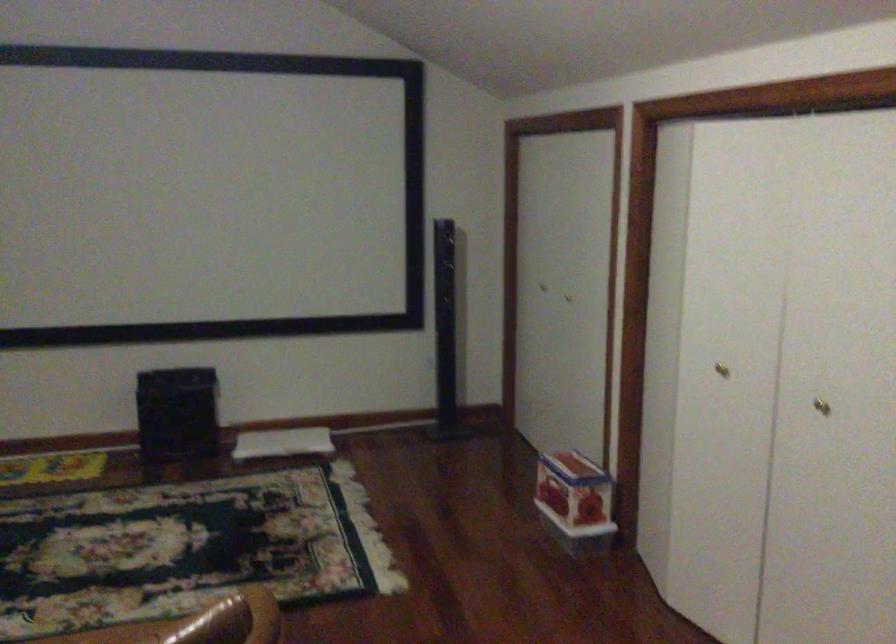
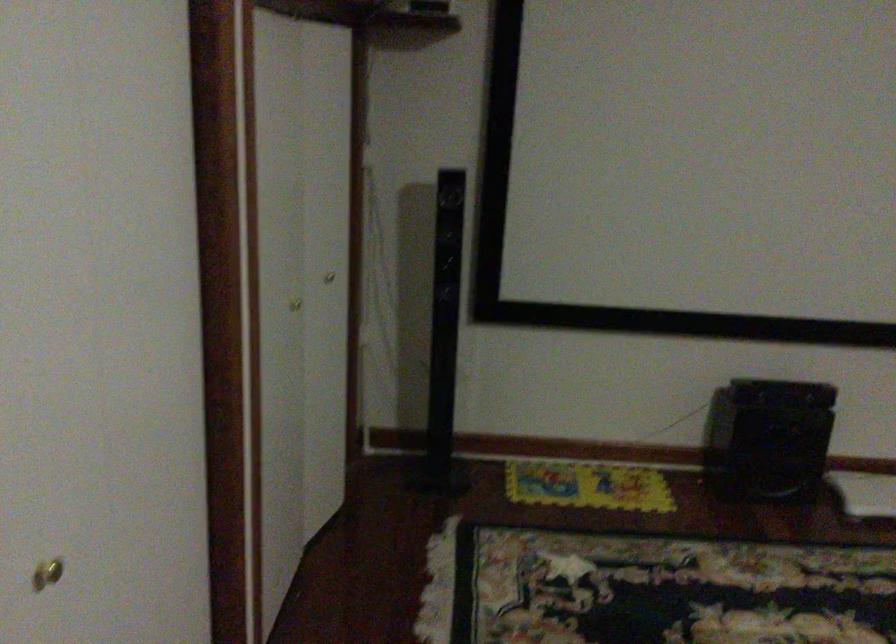
What movement of the cameraman would produce the second image?

The cameraman walked toward left, forward.